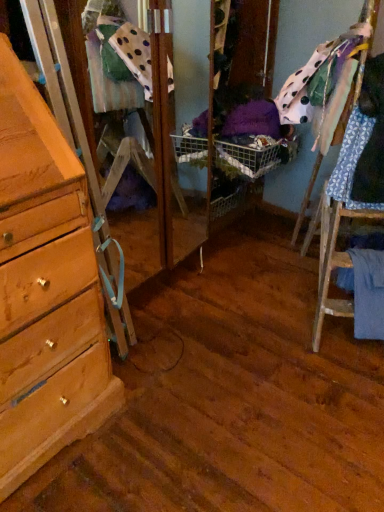
Question: Should I look upward or downward to see blue fabric at lower right, which is counted as the first clothing, starting from the bottom?

Choices:
 (A) up
 (B) down

Answer: (B)

Question: Considering the relative positions of blue patterned fabric at right, the second clothing from the top, and polka dot fabric at upper right, the 3th clothing ordered from the bottom, in the image provided, is blue patterned fabric at right, the second clothing from the top, behind polka dot fabric at upper right, the 3th clothing ordered from the bottom,?

Choices:
 (A) no
 (B) yes

Answer: (A)

Question: Is blue patterned fabric at right, the second clothing from the top, facing away from polka dot fabric at upper right, the 3th clothing ordered from the bottom?

Choices:
 (A) no
 (B) yes

Answer: (A)

Question: Is blue patterned fabric at right, the second clothing from the top, positioned beyond the bounds of polka dot fabric at upper right, placed as the first clothing when sorted from top to bottom?

Choices:
 (A) no
 (B) yes

Answer: (B)

Question: Is blue patterned fabric at right, which is the second clothing in bottom-to-top order, to the right of polka dot fabric at upper right, the 3th clothing ordered from the bottom, from the viewer's perspective?

Choices:
 (A) no
 (B) yes

Answer: (B)

Question: Can you confirm if blue patterned fabric at right, the second clothing from the top, is shorter than polka dot fabric at upper right, the 3th clothing ordered from the bottom?

Choices:
 (A) no
 (B) yes

Answer: (B)

Question: From the image's perspective, is blue patterned fabric at right, which is the second clothing in bottom-to-top order, under polka dot fabric at upper right, the 3th clothing ordered from the bottom?

Choices:
 (A) yes
 (B) no

Answer: (A)

Question: From the image's perspective, is blue fabric at lower right, marked as the third clothing in a top-to-bottom arrangement, below polka dot fabric at upper right, the 3th clothing ordered from the bottom?

Choices:
 (A) no
 (B) yes

Answer: (B)

Question: Could polka dot fabric at upper right, placed as the first clothing when sorted from top to bottom, be considered to be inside blue fabric at lower right, which is counted as the first clothing, starting from the bottom?

Choices:
 (A) yes
 (B) no

Answer: (B)

Question: Is blue fabric at lower right, which is counted as the first clothing, starting from the bottom, thinner than polka dot fabric at upper right, the 3th clothing ordered from the bottom?

Choices:
 (A) no
 (B) yes

Answer: (B)

Question: Does blue fabric at lower right, marked as the third clothing in a top-to-bottom arrangement, have a greater height compared to polka dot fabric at upper right, the 3th clothing ordered from the bottom?

Choices:
 (A) no
 (B) yes

Answer: (B)

Question: Does blue fabric at lower right, marked as the third clothing in a top-to-bottom arrangement, lie in front of polka dot fabric at upper right, placed as the first clothing when sorted from top to bottom?

Choices:
 (A) no
 (B) yes

Answer: (A)

Question: From the image's perspective, would you say blue fabric at lower right, marked as the third clothing in a top-to-bottom arrangement, is positioned over polka dot fabric at upper right, placed as the first clothing when sorted from top to bottom?

Choices:
 (A) no
 (B) yes

Answer: (A)

Question: Is polka dot fabric at upper right, placed as the first clothing when sorted from top to bottom, in contact with blue patterned fabric at right, the second clothing from the top?

Choices:
 (A) no
 (B) yes

Answer: (A)